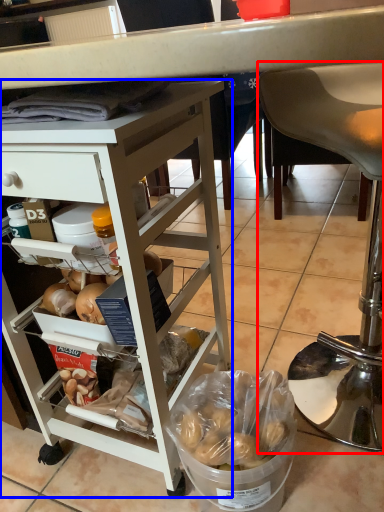
Question: Which point is further to the camera, chair (highlighted by a red box) or desk (highlighted by a blue box)?

Choices:
 (A) chair
 (B) desk

Answer: (A)